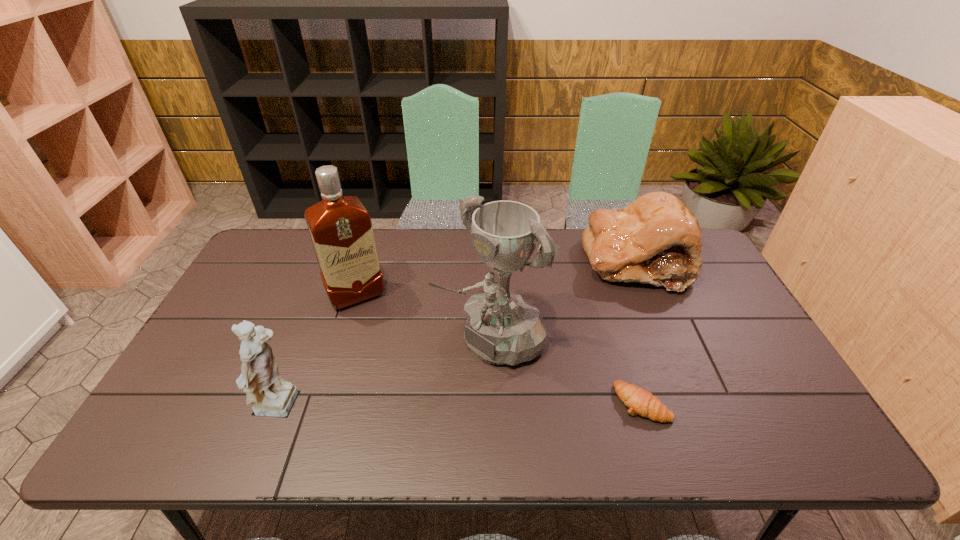
You are a GUI agent. You are given a task and a screenshot of the screen. Output one action in this format:
    pyautogui.click(x=<x>, y=<y>)
    Task: Click on the free space located on the side with emblem of the award
    The height and width of the screenshot is (540, 960).
    Given the screenshot: What is the action you would take?
    pyautogui.click(x=397, y=413)

This screenshot has width=960, height=540. In order to click on vacant space situated on the side with emblem of the award in this screenshot , I will do `click(431, 383)`.

I want to click on free space located 0.110m on the side with emblem of the award, so click(x=425, y=388).

You are a GUI agent. You are given a task and a screenshot of the screen. Output one action in this format:
    pyautogui.click(x=<x>, y=<y>)
    Task: Click on the free space located 0.070m on the front label of the liquor
    The height and width of the screenshot is (540, 960).
    Given the screenshot: What is the action you would take?
    pyautogui.click(x=374, y=327)

What are the coordinates of `vacant space located 0.260m on the front label of the liquor` in the screenshot? It's located at (399, 375).

The image size is (960, 540). I want to click on vacant space located 0.250m on the front label of the liquor, so click(x=398, y=372).

You are a GUI agent. You are given a task and a screenshot of the screen. Output one action in this format:
    pyautogui.click(x=<x>, y=<y>)
    Task: Click on the object that is at the far edge
    Image resolution: width=960 pixels, height=540 pixels.
    Given the screenshot: What is the action you would take?
    pyautogui.click(x=656, y=239)

The width and height of the screenshot is (960, 540). What are the coordinates of `figurine present at the near edge` in the screenshot? It's located at (270, 396).

Identify the location of crescent roll at the near edge. (640, 401).

The image size is (960, 540). I want to click on object located in the right edge section of the desktop, so click(x=656, y=239).